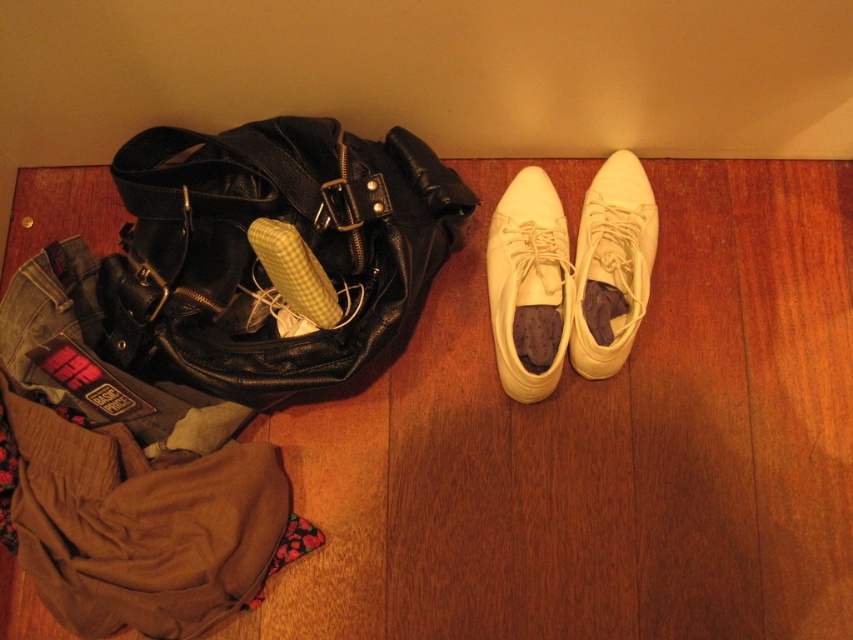
You are organizing items on a wooden floor and need to place the black leather bag at left and the white leather running shoe at center right next to each other. Based on their widths, which item should be placed first to ensure they fit side by side without overlapping?

The black leather bag at left is wider than the white leather running shoe at center right, so you should place the black leather bag at left first to accommodate its larger width before placing the white leather running shoe at center right.